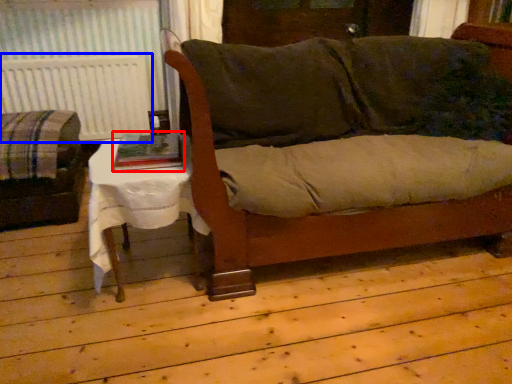
Question: Which of the following is the closest to the observer, book (highlighted by a red box) or radiator (highlighted by a blue box)?

Choices:
 (A) book
 (B) radiator

Answer: (A)